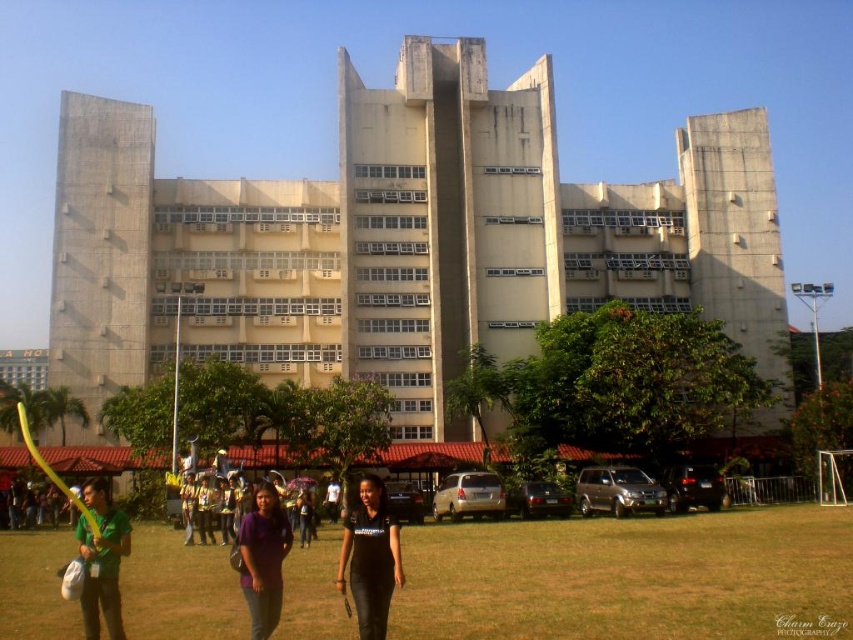
Question: In this image, where is green grass at lower center located relative to green matte shirt at lower left?

Choices:
 (A) below
 (B) above

Answer: (A)

Question: Does black leather pants at center appear under purple fabric umbrella at center?

Choices:
 (A) no
 (B) yes

Answer: (A)

Question: Which point is farther to the camera?

Choices:
 (A) green matte shirt at lower left
 (B) purple matte shirt at center

Answer: (A)

Question: Which of the following is the closest to the observer?

Choices:
 (A) (303, 529)
 (B) (351, 588)

Answer: (B)

Question: Observing the image, what is the correct spatial positioning of green matte shirt at lower left in reference to purple fabric umbrella at center?

Choices:
 (A) below
 (B) above

Answer: (B)

Question: Which of these objects is positioned closest to the purple fabric umbrella at center?

Choices:
 (A) green matte shirt at lower left
 (B) black leather pants at center

Answer: (B)